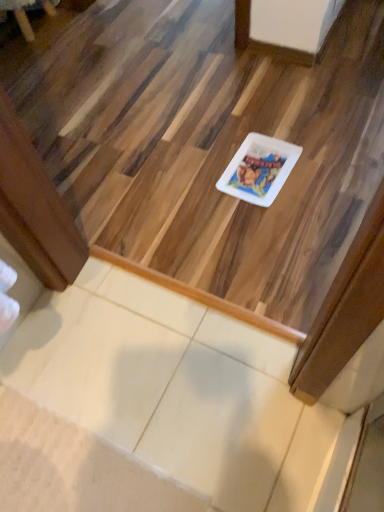
The width and height of the screenshot is (384, 512). What are the coordinates of `free space on the front side of brushed metal table at upper left` in the screenshot? It's located at (43, 56).